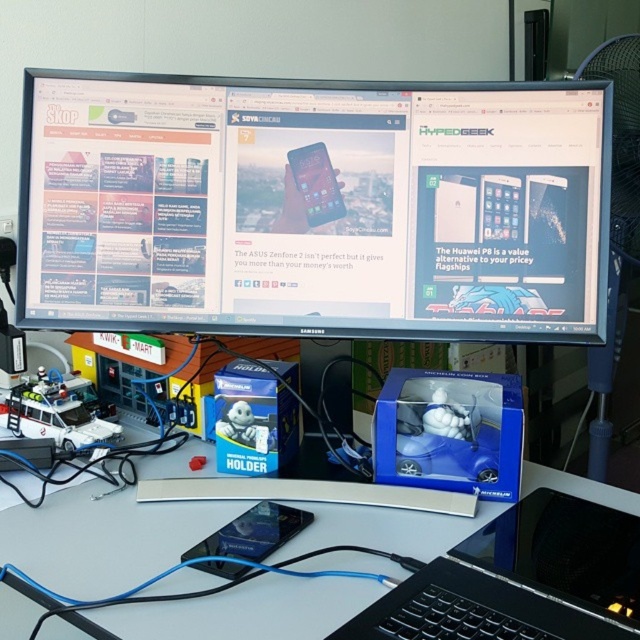
Describe the element at coordinates (104, 538) in the screenshot. I see `white plastic table at center` at that location.

Looking at this image, is white plastic table at center closer to the viewer compared to black plastic laptop at lower right?

No.

Is point (400, 572) less distant than point (620, 564)?

No, it is behind (620, 564).

What are the coordinates of `white plastic table at center` in the screenshot? It's located at (104, 538).

Based on the photo, which is above, black glossy monitor at upper center or white plastic table at center?

black glossy monitor at upper center is above.

Does point (204, 227) lie behind point (8, 582)?

Yes, it is behind point (8, 582).

Identify the location of black glossy monitor at upper center. This screenshot has width=640, height=640. (314, 205).

Does black glossy monitor at upper center lie behind black plastic laptop at lower right?

Yes, black glossy monitor at upper center is behind black plastic laptop at lower right.

What do you see at coordinates (314, 205) in the screenshot?
I see `black glossy monitor at upper center` at bounding box center [314, 205].

This screenshot has height=640, width=640. In order to click on black glossy monitor at upper center in this screenshot , I will do `click(314, 205)`.